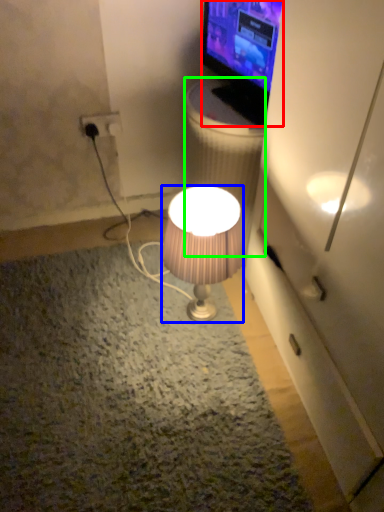
Question: Considering the real-world distances, which object is farthest from television (highlighted by a red box)? lamp (highlighted by a blue box) or trash bin/can (highlighted by a green box)?

Choices:
 (A) lamp
 (B) trash bin/can

Answer: (A)